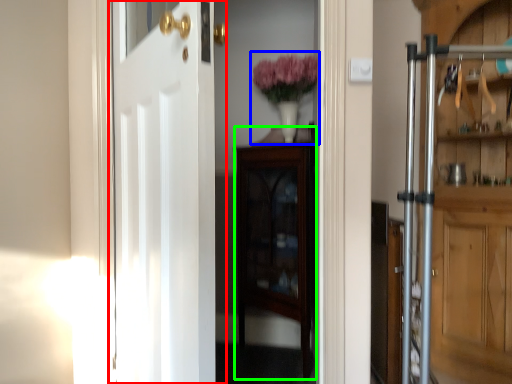
Question: Estimate the real-world distances between objects in this image. Which object is closer to door (highlighted by a red box), floral arrangement (highlighted by a blue box) or cabinetry (highlighted by a green box)?

Choices:
 (A) floral arrangement
 (B) cabinetry

Answer: (B)